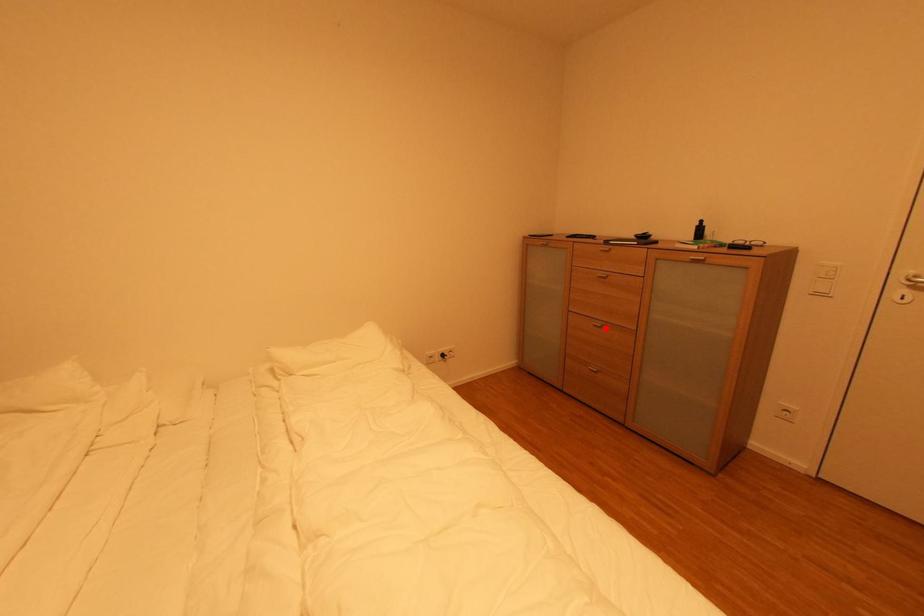
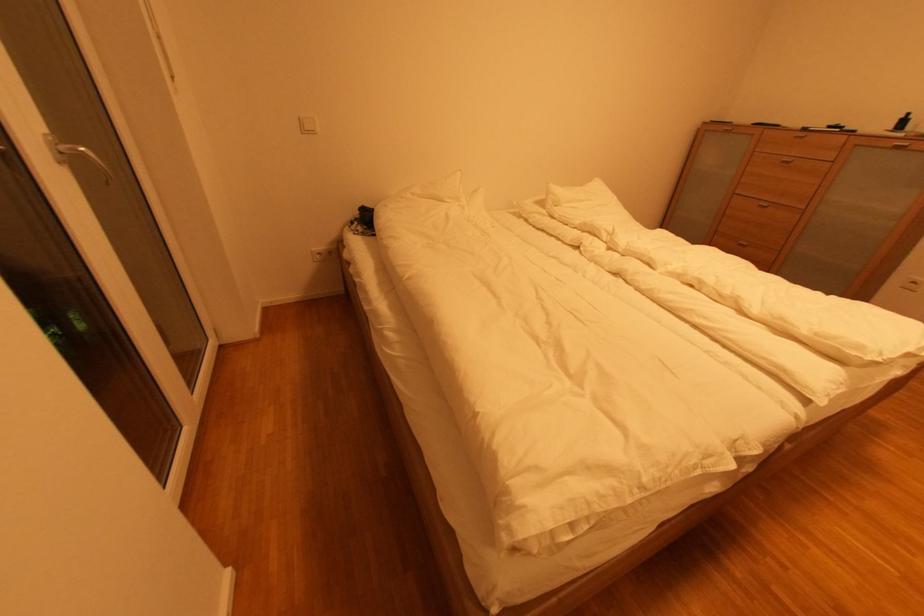
Locate, in the second image, the point that corresponds to the highlighted location in the first image.

(772, 208)